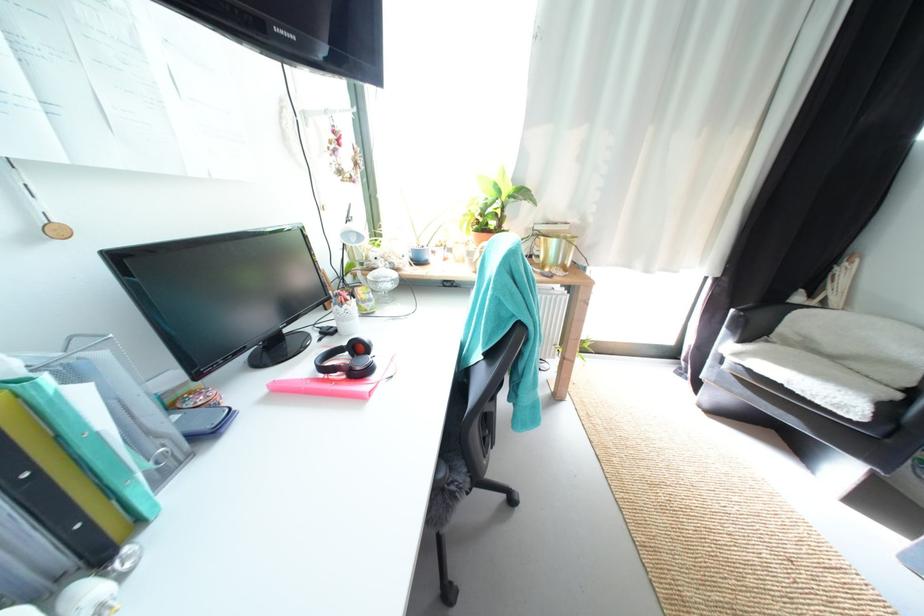
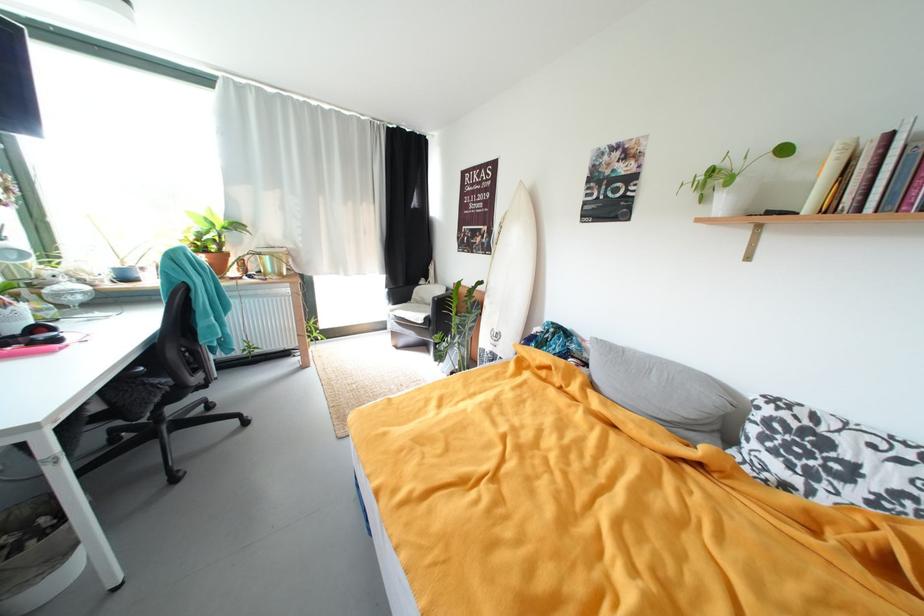
In the second image, find the point that corresponds to (x=745, y=357) in the first image.

(399, 313)